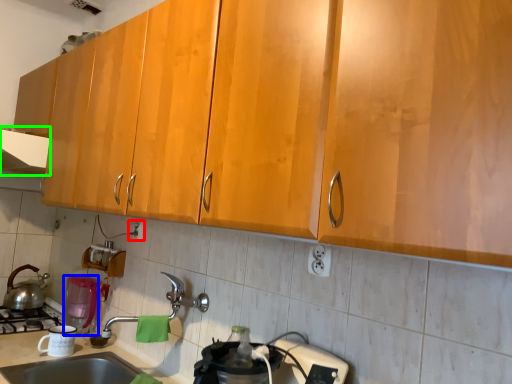
Question: Based on their relative distances, which object is farther from electric outlet (highlighted by a red box)? Choose from appliance (highlighted by a blue box) and exhaust hood (highlighted by a green box).

Choices:
 (A) appliance
 (B) exhaust hood

Answer: (B)